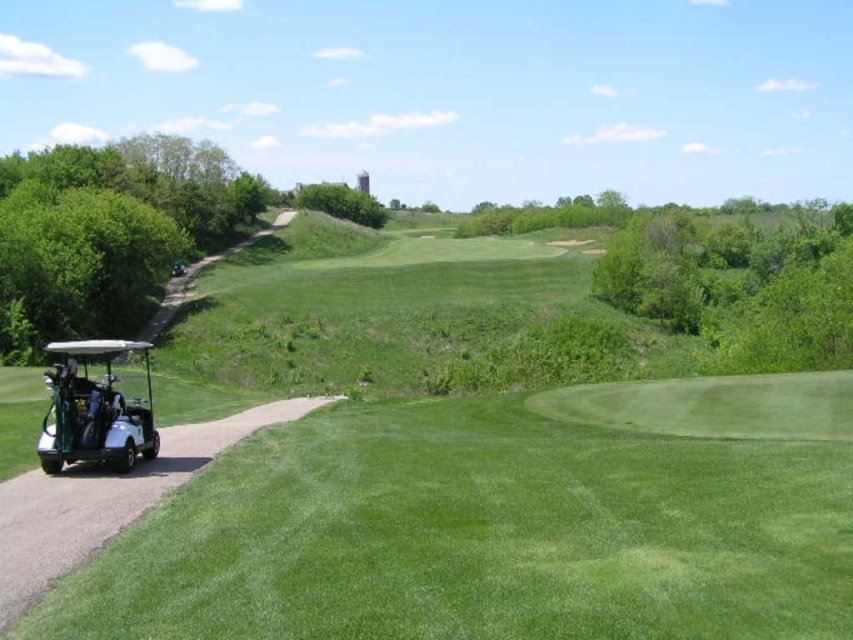
From the picture: Is white matte golf cart at left taller than white matte golf cart at lower left?

Indeed, white matte golf cart at left has a greater height compared to white matte golf cart at lower left.

Can you confirm if white matte golf cart at left is positioned to the right of white matte golf cart at lower left?

Indeed, white matte golf cart at left is positioned on the right side of white matte golf cart at lower left.

Which is in front, point (585, 529) or point (109, 394)?

Point (585, 529) is in front.

Find the location of a particular element. Image resolution: width=853 pixels, height=640 pixels. white matte golf cart at left is located at coordinates (466, 476).